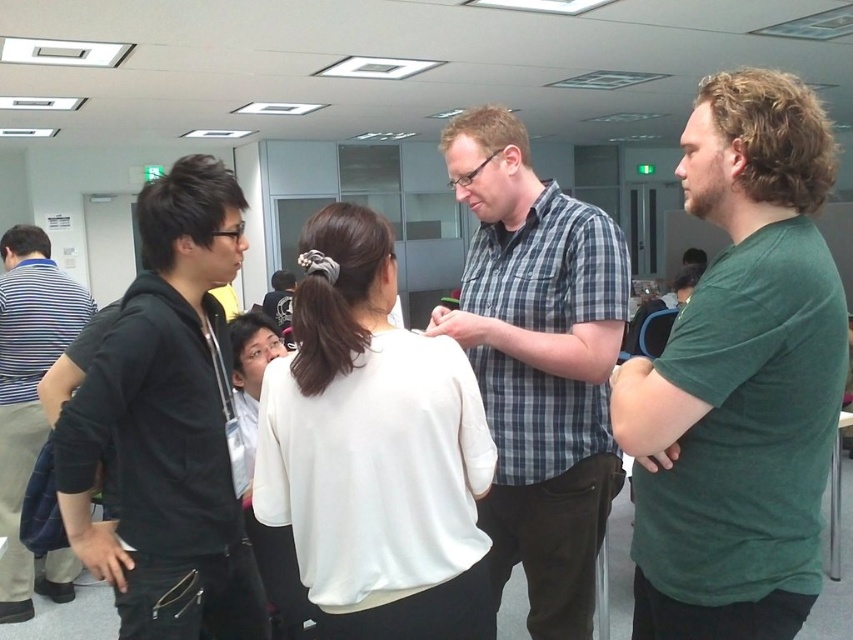
Between plaid shirt at center and black hoodie at left, which one has less height?

Standing shorter between the two is black hoodie at left.

This screenshot has width=853, height=640. What do you see at coordinates (538, 364) in the screenshot?
I see `plaid shirt at center` at bounding box center [538, 364].

Who is more forward, (611, 289) or (177, 339)?

Positioned in front is point (177, 339).

Where is `plaid shirt at center`? plaid shirt at center is located at coordinates (538, 364).

Where is `white matte shirt at center`? white matte shirt at center is located at coordinates (374, 451).

Find the location of a particular element. The width and height of the screenshot is (853, 640). white matte shirt at center is located at coordinates (374, 451).

The image size is (853, 640). In order to click on white matte shirt at center in this screenshot , I will do `click(374, 451)`.

Which is more to the left, green matte shirt at right or striped cotton shirt at left?

From the viewer's perspective, striped cotton shirt at left appears more on the left side.

Describe the element at coordinates (740, 378) in the screenshot. This screenshot has height=640, width=853. I see `green matte shirt at right` at that location.

In order to click on green matte shirt at right in this screenshot , I will do `click(740, 378)`.